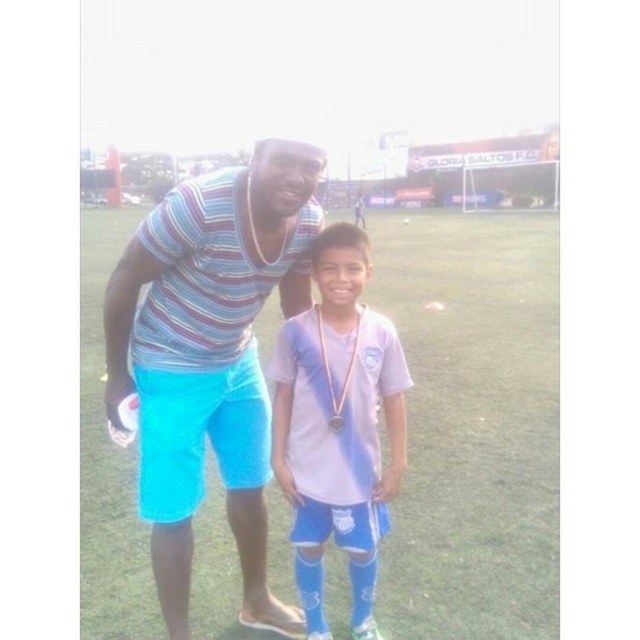
Is striped cotton shirt at center wider than gold metallic medal at center?

Indeed, striped cotton shirt at center has a greater width compared to gold metallic medal at center.

Which is more to the right, striped cotton shirt at center or gold metallic medal at center?

Positioned to the right is gold metallic medal at center.

Which is behind, point (188, 396) or point (339, 428)?

Point (188, 396)

Where is `striped cotton shirt at center`? Image resolution: width=640 pixels, height=640 pixels. striped cotton shirt at center is located at coordinates (209, 356).

Is striped cotton shirt at center shorter than white jersey at center?

No.

Does striped cotton shirt at center have a greater height compared to white jersey at center?

Yes, striped cotton shirt at center is taller than white jersey at center.

Where is `striped cotton shirt at center`? The width and height of the screenshot is (640, 640). striped cotton shirt at center is located at coordinates (x=209, y=356).

Does green grass at center have a lesser height compared to white jersey at center?

No, green grass at center is not shorter than white jersey at center.

Who is taller, green grass at center or white jersey at center?

green grass at center is taller.

Describe the element at coordinates (474, 424) in the screenshot. This screenshot has height=640, width=640. I see `green grass at center` at that location.

At what (x,y) coordinates should I click in order to perform the action: click on green grass at center. Please return your answer as a coordinate pair (x, y). The width and height of the screenshot is (640, 640). Looking at the image, I should click on (474, 424).